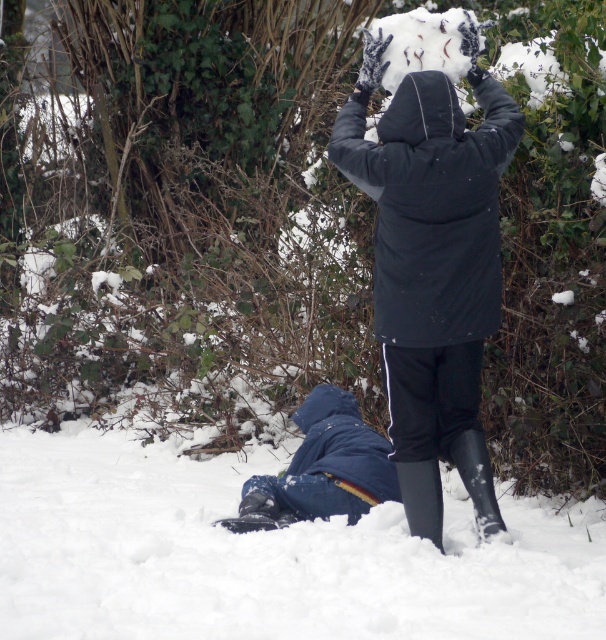
You are taking a photo of the snowy scene and want to focus on both the person lying down and the standing person. Which of the two points, point (410,193) or point (482,458), is closer to your camera lens?

Point (410,193) is closer to the camera lens than point (482,458).

You are trying to decide which pair of boots to wear for a snow walk. You see the rubber boots at lower center and the black rubber boot at lower center in the image. Which pair is bigger?

The rubber boots at lower center are larger in size than the black rubber boot at lower center.